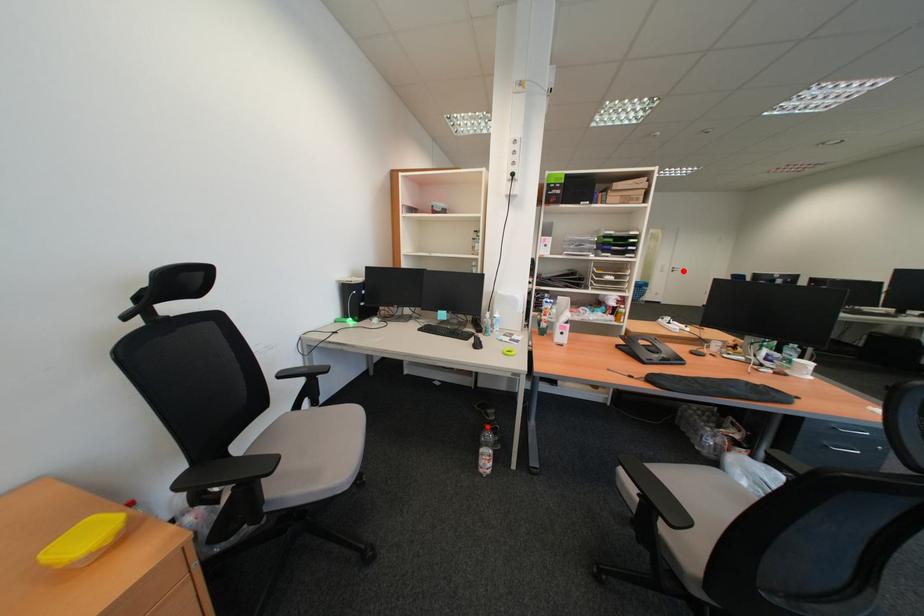
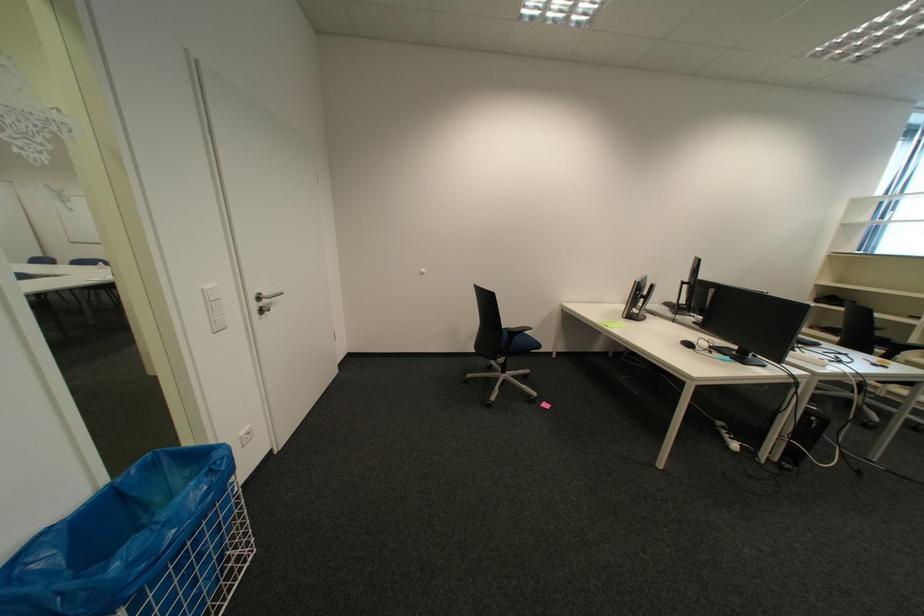
The point at the highlighted location is marked in the first image. Where is the corresponding point in the second image?

(266, 307)